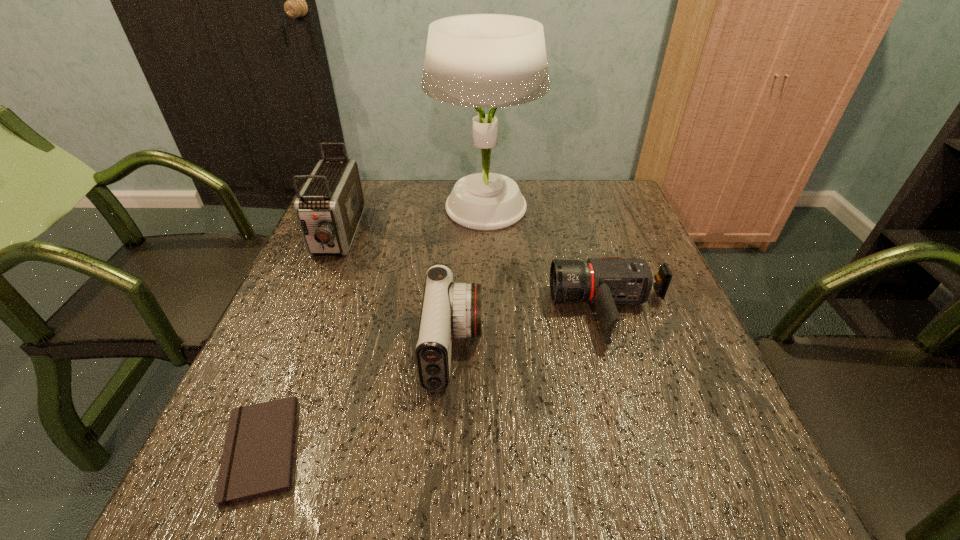
Identify the location of blank region between the checkbook and the tallest camcorder. (300, 342).

The image size is (960, 540). I want to click on vacant space that is in between the rightmost camcorder and the third shortest object, so click(x=532, y=329).

Locate which object is the fourth closest to the farthest camcorder. Please provide its 2D coordinates. Your answer should be formatted as a tuple, i.e. [(x, y)], where the tuple contains the x and y coordinates of a point satisfying the conditions above.

[(605, 282)]

In order to click on object that is the fourth closest to the rightmost camcorder in this screenshot , I will do `click(329, 207)`.

Locate an element on the screen. The height and width of the screenshot is (540, 960). camcorder object that ranks as the closest to the second tallest object is located at coordinates (449, 309).

The width and height of the screenshot is (960, 540). Identify the location of camcorder identified as the second closest to the leftmost camcorder. (605, 282).

I want to click on vacant space that satisfies the following two spatial constraints: 1. on the surface of the second camcorder from right to left; 2. on the front side of the checkbook, so click(x=447, y=449).

Where is `free location that satisfies the following two spatial constraints: 1. on the front-facing side of the lamp; 2. at the lens of the farthest camcorder`? free location that satisfies the following two spatial constraints: 1. on the front-facing side of the lamp; 2. at the lens of the farthest camcorder is located at coordinates (485, 235).